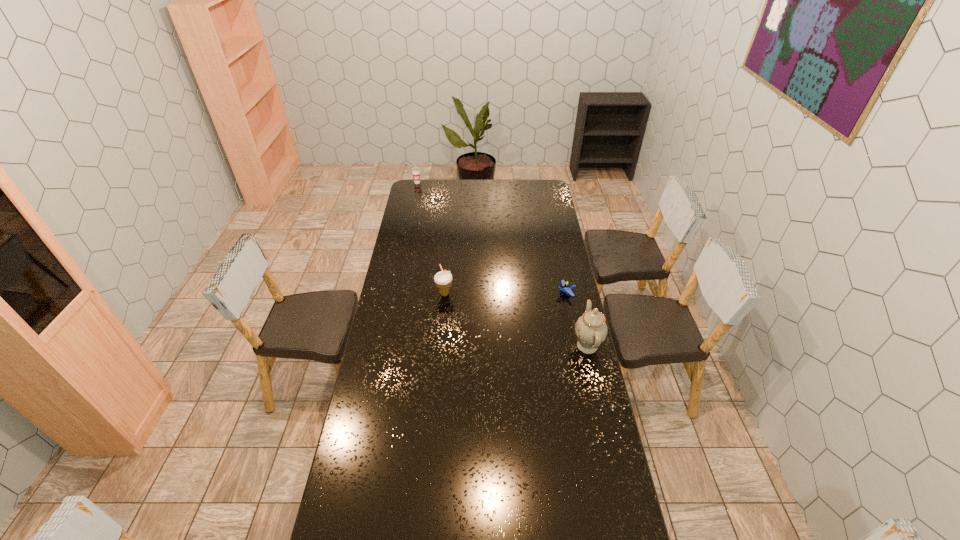
This screenshot has width=960, height=540. Identify the location of free spot between the nearest object and the shortest object. (577, 319).

The height and width of the screenshot is (540, 960). Identify the location of free space that is in between the leftmost object and the nearest object. (502, 264).

Identify the location of free space that is in between the leftmost object and the Lego. The width and height of the screenshot is (960, 540). (492, 238).

At what (x,y) coordinates should I click in order to perform the action: click on free area in between the shortest object and the icecream. Please return your answer as a coordinate pair (x, y). Looking at the image, I should click on (505, 293).

Locate an element on the screen. The image size is (960, 540). free space between the third object from right to left and the farthest object is located at coordinates (431, 238).

In order to click on blank region between the farthest object and the shortest object in this screenshot , I will do `click(492, 238)`.

Choose which object is the nearest neighbor to the tallest object. Please provide its 2D coordinates. Your answer should be formatted as a tuple, i.e. [(x, y)], where the tuple contains the x and y coordinates of a point satisfying the conditions above.

[(566, 287)]

Choose which object is the third nearest neighbor to the third object from right to left. Please provide its 2D coordinates. Your answer should be formatted as a tuple, i.e. [(x, y)], where the tuple contains the x and y coordinates of a point satisfying the conditions above.

[(416, 170)]

Image resolution: width=960 pixels, height=540 pixels. Find the location of `free space that satisfies the following two spatial constraints: 1. on the back side of the Lego; 2. on the right side of the icecream`. free space that satisfies the following two spatial constraints: 1. on the back side of the Lego; 2. on the right side of the icecream is located at coordinates (444, 293).

Locate an element on the screen. The height and width of the screenshot is (540, 960). vacant region that satisfies the following two spatial constraints: 1. on the front side of the chinaware; 2. on the spout of the Lego is located at coordinates (577, 346).